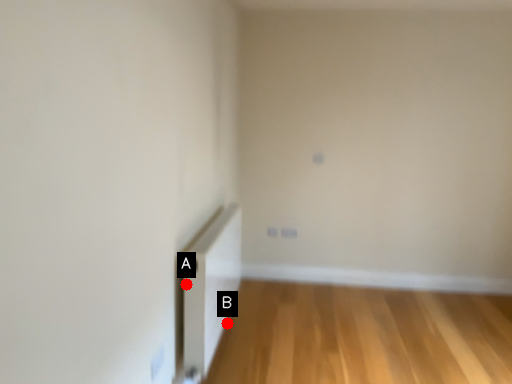
Question: Two points are circled on the image, labeled by A and B beside each circle. Which point is closer to the camera taking this photo?

Choices:
 (A) A is closer
 (B) B is closer

Answer: (A)